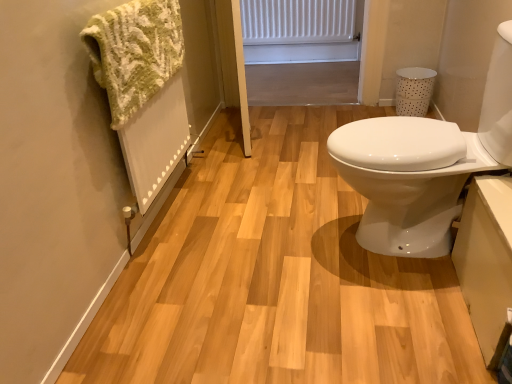
Where is `white glossy sink at right`? Image resolution: width=512 pixels, height=384 pixels. white glossy sink at right is located at coordinates (424, 166).

The image size is (512, 384). I want to click on green knitted towel at left, so click(x=134, y=52).

Consider the image. Who is bigger, white glossy sink at right or white matte radiator at upper center?

white glossy sink at right is bigger.

In the scene shown: From the image's perspective, is white glossy sink at right above white matte radiator at upper center?

No, from the image's perspective, white glossy sink at right is not above white matte radiator at upper center.

This screenshot has width=512, height=384. Identify the location of radiator behind the white glossy sink at right. (297, 21).

Is white glossy sink at right far from white matte radiator at upper center?

white glossy sink at right is far away from white matte radiator at upper center.

Which is correct: green knitted towel at left is inside white matte radiator at upper center, or outside of it?

green knitted towel at left is located beyond the bounds of white matte radiator at upper center.

Is there a large distance between green knitted towel at left and white matte radiator at upper center?

Yes.

Consider the image. Considering the sizes of green knitted towel at left and white matte radiator at upper center in the image, is green knitted towel at left wider or thinner than white matte radiator at upper center?

green knitted towel at left is wider than white matte radiator at upper center.

Considering the sizes of objects green knitted towel at left and white glossy sink at right in the image provided, who is shorter, green knitted towel at left or white glossy sink at right?

With less height is green knitted towel at left.

Would you say green knitted towel at left is a long distance from white glossy sink at right?

No, green knitted towel at left is not far away from white glossy sink at right.

Is green knitted towel at left closer to the viewer compared to white glossy sink at right?

No.

Is green knitted towel at left aimed at white glossy sink at right?

Yes, green knitted towel at left is aimed at white glossy sink at right.

Is point (408, 126) more distant than point (123, 12)?

Yes.

Looking at this image, would you say white glossy sink at right is inside or outside green knitted towel at left?

white glossy sink at right cannot be found inside green knitted towel at left.

Which of these two, white glossy sink at right or green knitted towel at left, is wider?

Wider between the two is white glossy sink at right.

How distant is white glossy sink at right from green knitted towel at left?

white glossy sink at right and green knitted towel at left are 34.65 inches apart from each other.

Is white matte radiator at upper center shorter than green knitted towel at left?

Indeed, white matte radiator at upper center has a lesser height compared to green knitted towel at left.

Is the position of white matte radiator at upper center more distant than that of green knitted towel at left?

Yes, it is behind green knitted towel at left.

Are white matte radiator at upper center and green knitted towel at left beside each other?

They are not placed beside each other.

From a real-world perspective, is white matte radiator at upper center located beneath white glossy sink at right?

Yes, from a real-world perspective, white matte radiator at upper center is beneath white glossy sink at right.

Is white matte radiator at upper center oriented towards white glossy sink at right?

Yes, white matte radiator at upper center is facing white glossy sink at right.

Measure the distance from white matte radiator at upper center to white glossy sink at right.

They are 7.92 feet apart.

The width and height of the screenshot is (512, 384). Identify the location of radiator below the white glossy sink at right (from a real-world perspective). (297, 21).

Where is `bath towel above the white matte radiator at upper center (from a real-world perspective)`? The width and height of the screenshot is (512, 384). bath towel above the white matte radiator at upper center (from a real-world perspective) is located at coordinates (134, 52).

Estimate the real-world distances between objects in this image. Which object is closer to white matte radiator at upper center, green knitted towel at left or white glossy sink at right?

green knitted towel at left.

Considering their positions, is white matte radiator at upper center positioned further to green knitted towel at left than white glossy sink at right?

Among the two, white matte radiator at upper center is located further to green knitted towel at left.

When comparing their distances from white glossy sink at right, does white matte radiator at upper center or green knitted towel at left seem further?

white matte radiator at upper center is positioned further to the anchor white glossy sink at right.

Based on the photo, which object lies nearer to the anchor point white glossy sink at right, green knitted towel at left or white matte radiator at upper center?

green knitted towel at left.

Based on their spatial positions, is white glossy sink at right or green knitted towel at left further from white matte radiator at upper center?

Based on the image, white glossy sink at right appears to be further to white matte radiator at upper center.

In the scene shown: Looking at the image, which one is located further to green knitted towel at left, white glossy sink at right or white matte radiator at upper center?

white matte radiator at upper center is positioned further to the anchor green knitted towel at left.

Locate an element on the screen. The width and height of the screenshot is (512, 384). bath towel positioned between white glossy sink at right and white matte radiator at upper center from near to far is located at coordinates (134, 52).